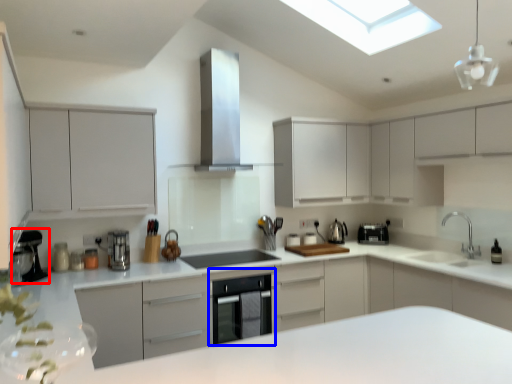
Question: Which point is further to the camera, coffee machine (highlighted by a red box) or dish washer (highlighted by a blue box)?

Choices:
 (A) coffee machine
 (B) dish washer

Answer: (B)